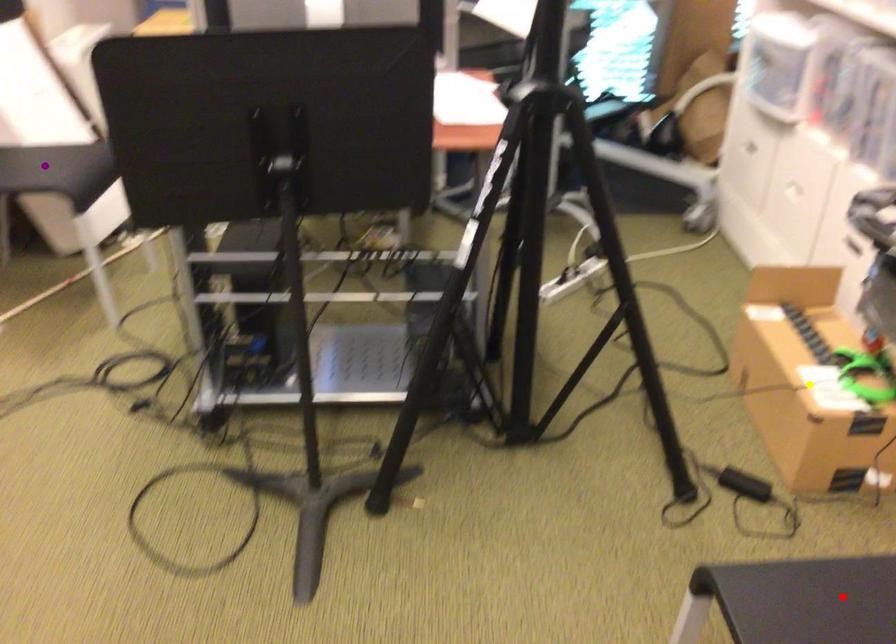
Order these from nearest to farthest:
1. red point
2. purple point
3. yellow point

1. red point
2. yellow point
3. purple point